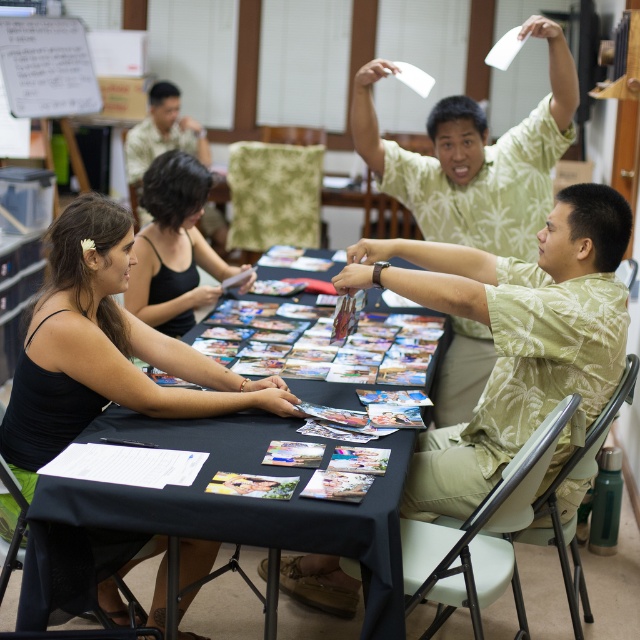
You are standing at the entrance of the room and want to place a new object at the exact center of the table. According to the image, where should you place it relative to the black paper at center?

The black paper at center is already positioned at the exact center of the table, so you should place the new object at the same location as the black paper at center.